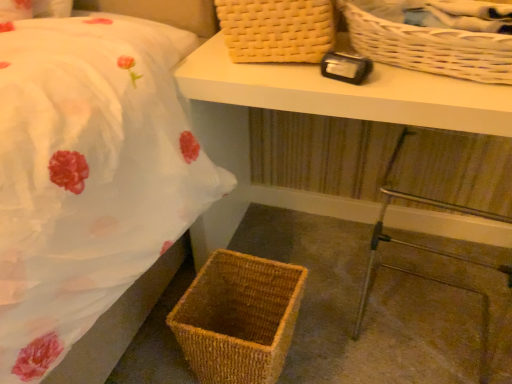
Question: From a real-world perspective, is brown woven picnic basket at lower left, the 3th picnic basket positioned from the top, above or below woven wicker basket at lower left?

Choices:
 (A) below
 (B) above

Answer: (B)

Question: Considering the positions of brown woven picnic basket at lower left, the 1th picnic basket ordered from the bottom, and woven wicker basket at lower left in the image, is brown woven picnic basket at lower left, the 1th picnic basket ordered from the bottom, taller or shorter than woven wicker basket at lower left?

Choices:
 (A) tall
 (B) short

Answer: (A)

Question: Estimate the real-world distances between objects in this image. Which object is farther from the woven wicker basket at lower left?

Choices:
 (A) white wicker picnic basket at upper right, which is counted as the second picnic basket, starting from the top
 (B) woven wood table at center
 (C) brown woven picnic basket at lower left, the 1th picnic basket ordered from the bottom
 (D) woven beige picnic basket at upper center, which appears as the third picnic basket when ordered from the bottom
 (E) metallic silver step stool at lower right

Answer: (D)

Question: Based on their relative distances, which object is farther from the woven wicker basket at lower left?

Choices:
 (A) woven wood table at center
 (B) woven beige picnic basket at upper center, arranged as the first picnic basket when viewed from the top
 (C) metallic silver step stool at lower right
 (D) brown woven picnic basket at lower left, the 1th picnic basket ordered from the bottom
 (E) white wicker picnic basket at upper right, which is counted as the second picnic basket, starting from the top

Answer: (B)